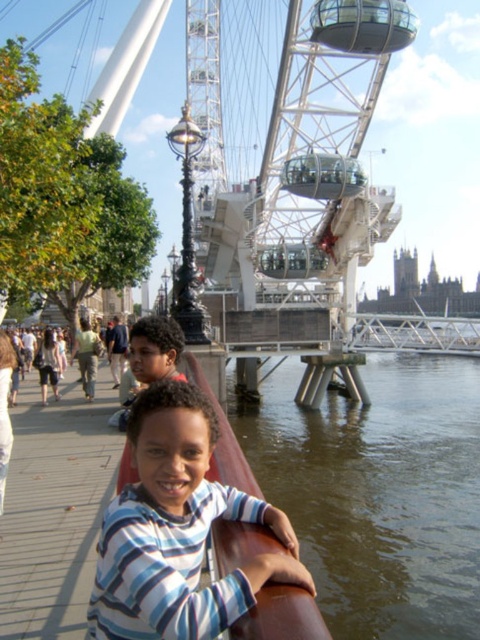
You are standing on the wooden walkway near the black lamppost and want to locate the brown water at lower right. According to the coordinates provided, where exactly should you look?

You should look at point (381, 493) to find the brown water at lower right.

You are standing on the wooden walkway near the black lamppost and want to take a photo of the white metallic ferris wheel at center. To include the brown water at lower right in your photo, which direction should you aim your camera relative to the ferris wheel?

You should aim your camera to the right of the white metallic ferris wheel at center to include the brown water at lower right, as the brown water at lower right is located to the right of it.

You are standing at the origin point of the coordinate system. Which direction should you move to reach the white metallic ferris wheel at center?

The white metallic ferris wheel at center is located at point 0.222 in the x coordinate and 0.610 in the y coordinate. Since you are at the origin, you should move towards the positive x and positive y direction to reach it.